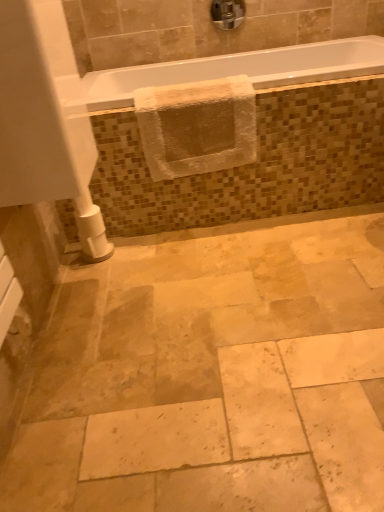
Question: Is chrome metallic faucet at upper center far from white glossy bathtub at upper center?

Choices:
 (A) yes
 (B) no

Answer: (B)

Question: Does chrome metallic faucet at upper center appear on the left side of white glossy bathtub at upper center?

Choices:
 (A) no
 (B) yes

Answer: (B)

Question: Does chrome metallic faucet at upper center have a larger size compared to white glossy bathtub at upper center?

Choices:
 (A) yes
 (B) no

Answer: (B)

Question: Does chrome metallic faucet at upper center come in front of white glossy bathtub at upper center?

Choices:
 (A) yes
 (B) no

Answer: (B)

Question: Is chrome metallic faucet at upper center not within white glossy bathtub at upper center?

Choices:
 (A) yes
 (B) no

Answer: (A)

Question: Looking at the image, does natural stone tile at center seem bigger or smaller compared to white textured towel at upper center?

Choices:
 (A) big
 (B) small

Answer: (A)

Question: From the image's perspective, is natural stone tile at center positioned above or below white textured towel at upper center?

Choices:
 (A) above
 (B) below

Answer: (B)

Question: In terms of width, does natural stone tile at center look wider or thinner when compared to white textured towel at upper center?

Choices:
 (A) wide
 (B) thin

Answer: (A)

Question: Is point (49, 423) positioned closer to the camera than point (238, 158)?

Choices:
 (A) closer
 (B) farther

Answer: (A)

Question: From the image's perspective, is natural stone tile at center positioned above or below chrome metallic faucet at upper center?

Choices:
 (A) below
 (B) above

Answer: (A)

Question: In the image, is natural stone tile at center on the left side or the right side of chrome metallic faucet at upper center?

Choices:
 (A) left
 (B) right

Answer: (B)

Question: Which is correct: natural stone tile at center is inside chrome metallic faucet at upper center, or outside of it?

Choices:
 (A) inside
 (B) outside

Answer: (B)

Question: Considering the positions of point (233, 320) and point (218, 15), is point (233, 320) closer or farther from the camera than point (218, 15)?

Choices:
 (A) closer
 (B) farther

Answer: (A)

Question: From a real-world perspective, is white textured towel at upper center physically located above or below chrome metallic faucet at upper center?

Choices:
 (A) below
 (B) above

Answer: (A)

Question: Does point (226, 84) appear closer or farther from the camera than point (231, 9)?

Choices:
 (A) farther
 (B) closer

Answer: (B)